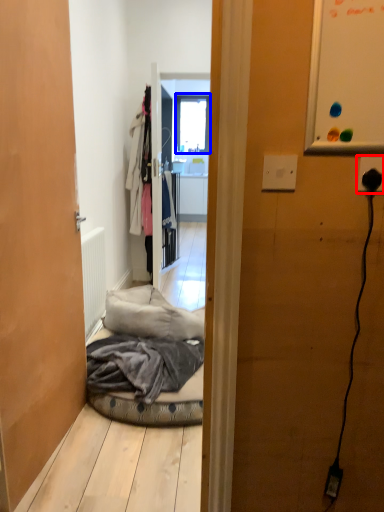
Question: Among these objects, which one is nearest to the camera, electric outlet (highlighted by a red box) or window (highlighted by a blue box)?

Choices:
 (A) electric outlet
 (B) window

Answer: (A)